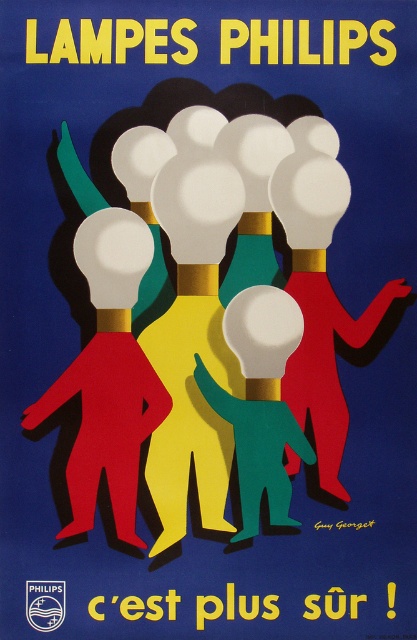
Can you confirm if matte red figure at center is shorter than green matte figure at center?

No, matte red figure at center is not shorter than green matte figure at center.

Does point (286, 161) come in front of point (241, 403)?

That is True.

The width and height of the screenshot is (417, 640). I want to click on matte red figure at center, so click(319, 301).

Who is positioned more to the left, matte white bulb at center or matte red figure at center?

matte white bulb at center

Who is taller, matte white bulb at center or matte red figure at center?

matte red figure at center is taller.

Describe the element at coordinates (108, 374) in the screenshot. The width and height of the screenshot is (417, 640). I see `matte white bulb at center` at that location.

The width and height of the screenshot is (417, 640). What are the coordinates of `matte white bulb at center` in the screenshot? It's located at pos(108,374).

Where is `matte white bulb at center`? This screenshot has width=417, height=640. matte white bulb at center is located at coordinates (108, 374).

Does matte white bulb at center appear on the left side of green matte figure at center?

Yes, matte white bulb at center is to the left of green matte figure at center.

Locate an element on the screen. matte white bulb at center is located at coordinates (108, 374).